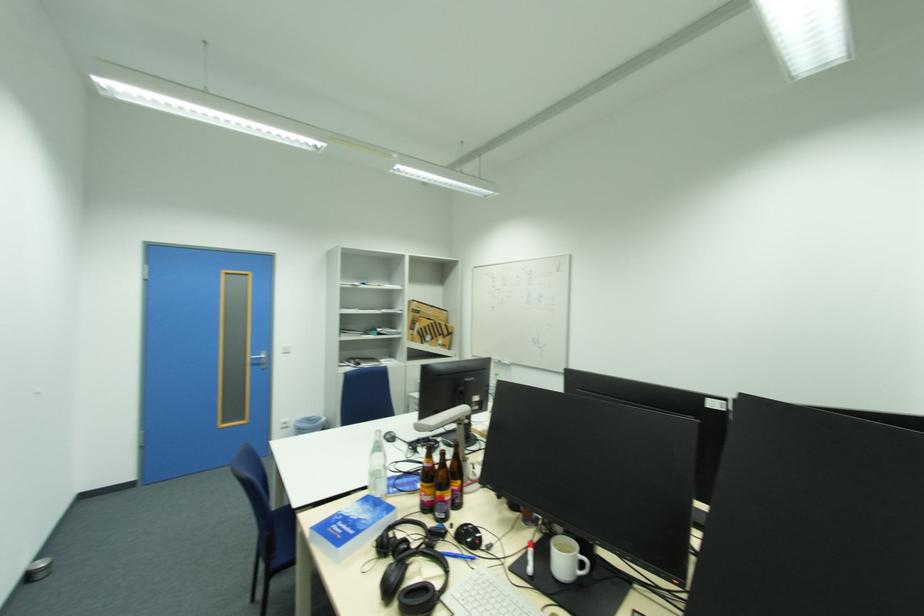
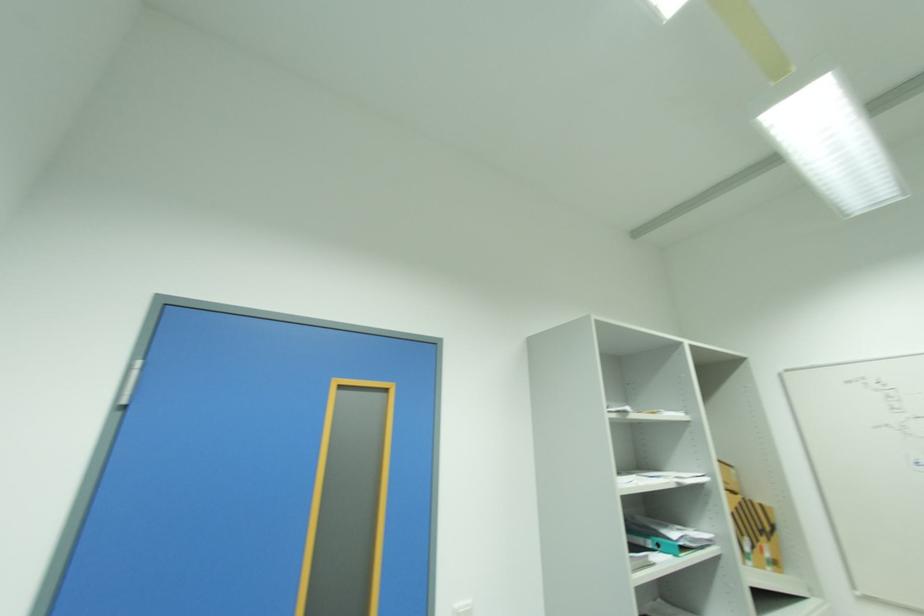
Find the pixel in the second image that matches (x=436, y=325) in the first image.

(746, 506)